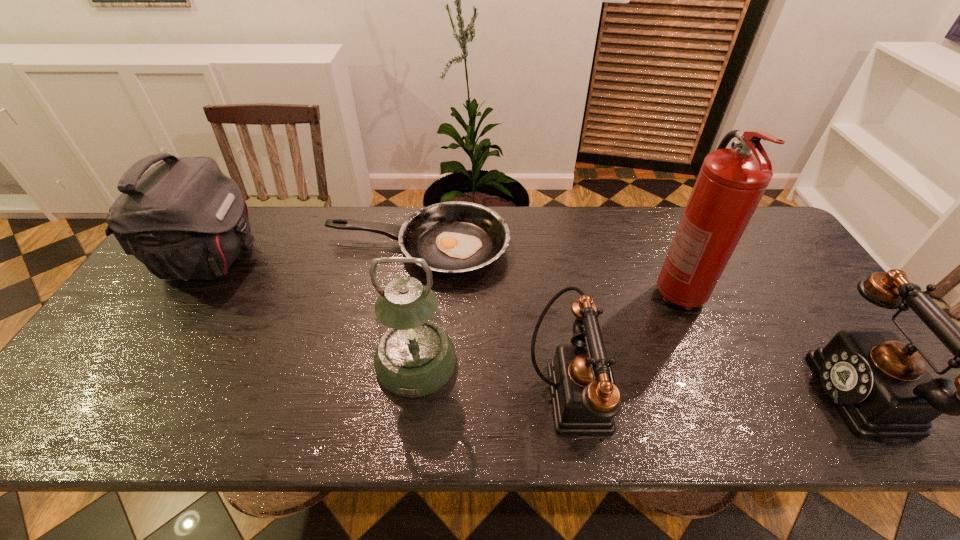
Observe the arrangement of all telephones in the image. To keep them evenly spaced, where would you place another telephone on the left? Please locate a free space. Please provide its 2D coordinates. Your answer should be formatted as a tuple, i.e. [(x, y)], where the tuple contains the x and y coordinates of a point satisfying the conditions above.

[(274, 389)]